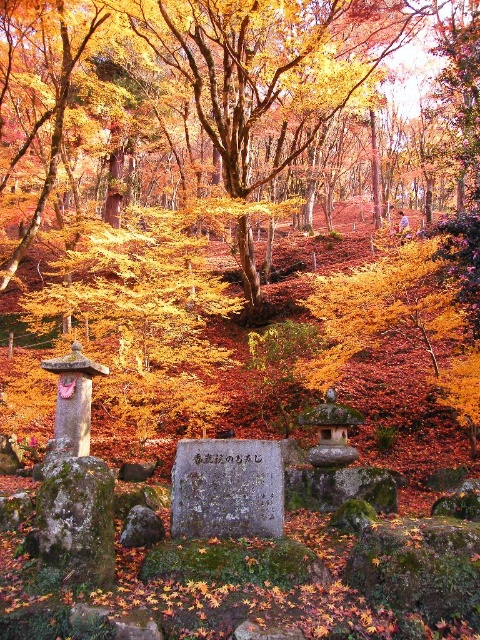
Measure the distance between gray stone plaque at center and camera.

The distance of gray stone plaque at center from camera is 5.53 meters.

Does point (264, 474) lie in front of point (93, 502)?

That is False.

At what (x,y) coordinates should I click in order to perform the action: click on gray stone plaque at center. Please return your answer as a coordinate pair (x, y). The width and height of the screenshot is (480, 640). Looking at the image, I should click on (227, 488).

You are a GUI agent. You are given a task and a screenshot of the screen. Output one action in this format:
    pyautogui.click(x=<x>, y=<y>)
    Task: Click on the gray stone plaque at center
    Image resolution: width=480 pixels, height=640 pixels.
    Given the screenshot: What is the action you would take?
    pyautogui.click(x=227, y=488)